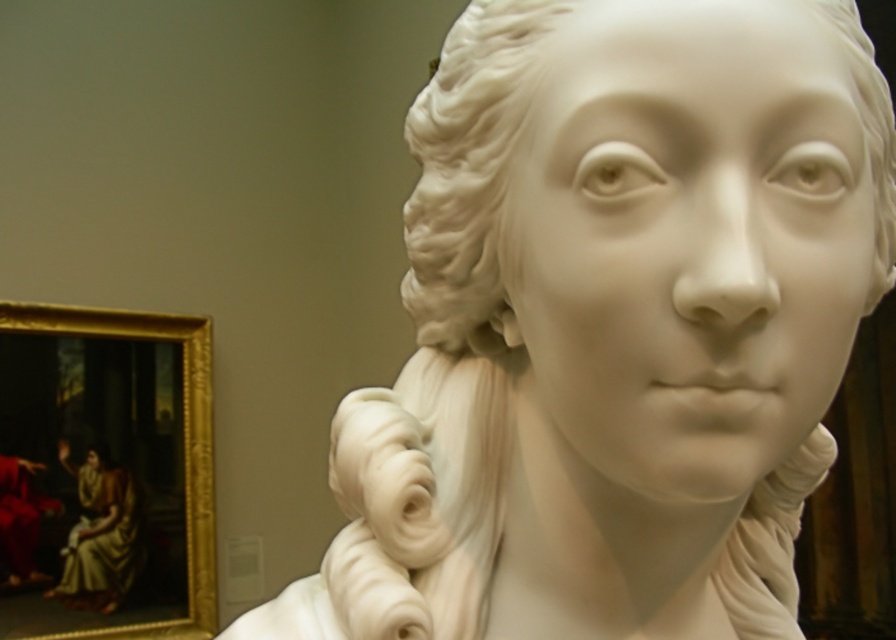
Is white marble bust at center positioned at the back of matte gold fabric at left?

No, white marble bust at center is in front of matte gold fabric at left.

Is point (416, 276) in front of point (99, 528)?

Yes, point (416, 276) is in front of point (99, 528).

The width and height of the screenshot is (896, 640). In order to click on white marble bust at center in this screenshot , I will do `click(470, 170)`.

Is white marble bust at center closer to camera compared to white marble bust at upper left?

Yes.

The width and height of the screenshot is (896, 640). I want to click on white marble bust at center, so click(470, 170).

Measure the distance between point (89, 568) and camera.

Point (89, 568) is 2.56 meters from camera.

Is matte gold fabric at left wider than white marble bust at upper left?

Correct, the width of matte gold fabric at left exceeds that of white marble bust at upper left.

Does point (97, 458) lie behind point (104, 468)?

No, it is not.

The image size is (896, 640). I want to click on matte gold fabric at left, so click(x=100, y=532).